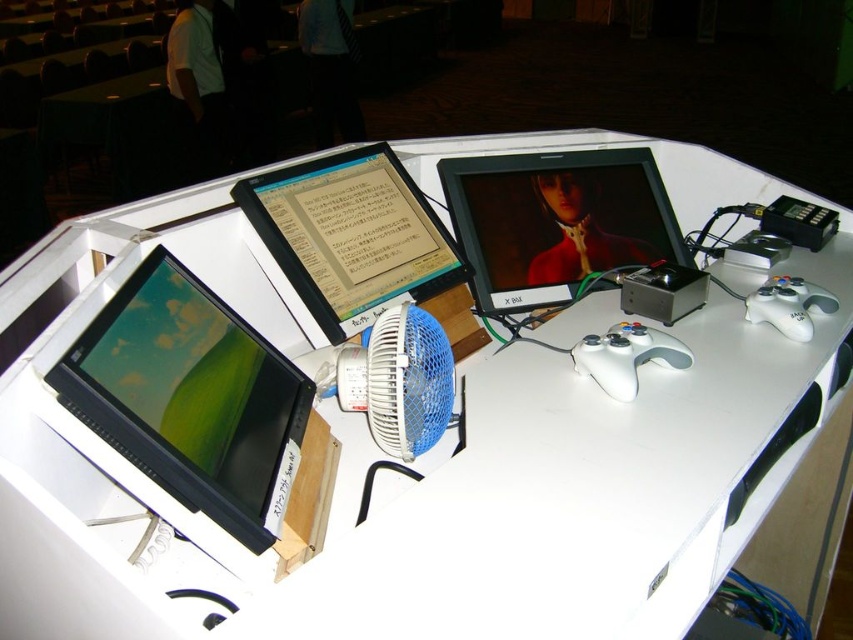
You are setting up a new desk and want to place a large plant between the matte black monitor at lower left and the blue plastic fan at center. Given that the plant requires 30 cm of space, can the space between them accommodate it?

The matte black monitor at lower left is larger than the blue plastic fan at center, but the exact distance between them isn

You are standing in front of the workstation and want to place a small object between the two points labeled point (490, 244) and point (332, 316). Which point should you place it closer to so that it appears closer to you?

You should place the small object closer to point (490, 244) because it is closer to the viewer than point (332, 316).

You are standing in front of the workstation shown in the image. There is a point at coordinates point (657, 192). If you want to place a 1.5 meter long cable from your current position to that point, will it be long enough?

The distance between you and the point (657, 192) is 1.48 meters. Since the cable is 1.5 meters long, it will be long enough to reach.